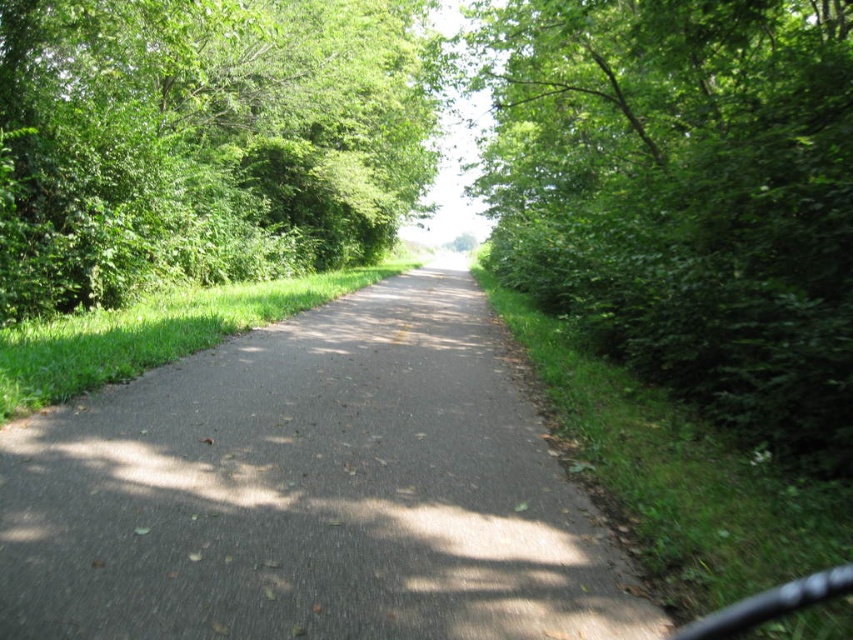
Can you confirm if green leafy tree at right is wider than green leafy tree at upper left?

In fact, green leafy tree at right might be narrower than green leafy tree at upper left.

Is green leafy tree at right in front of green leafy tree at upper left?

That is True.

Where is `green leafy tree at right`? This screenshot has width=853, height=640. green leafy tree at right is located at coordinates (688, 196).

This screenshot has height=640, width=853. Find the location of `green leafy tree at right`. green leafy tree at right is located at coordinates (688, 196).

Between smooth asphalt road at center and green leafy tree at right, which one has more height?

With more height is green leafy tree at right.

Does smooth asphalt road at center lie in front of green leafy tree at right?

Yes, it is.

You are a GUI agent. You are given a task and a screenshot of the screen. Output one action in this format:
    pyautogui.click(x=<x>, y=<y>)
    Task: Click on the smooth asphalt road at center
    
    Given the screenshot: What is the action you would take?
    pyautogui.click(x=312, y=492)

Measure the distance between point (170, 397) and camera.

A distance of 5.93 meters exists between point (170, 397) and camera.

What do you see at coordinates (312, 492) in the screenshot?
I see `smooth asphalt road at center` at bounding box center [312, 492].

This screenshot has width=853, height=640. What do you see at coordinates (312, 492) in the screenshot? I see `smooth asphalt road at center` at bounding box center [312, 492].

Identify the location of smooth asphalt road at center. (312, 492).